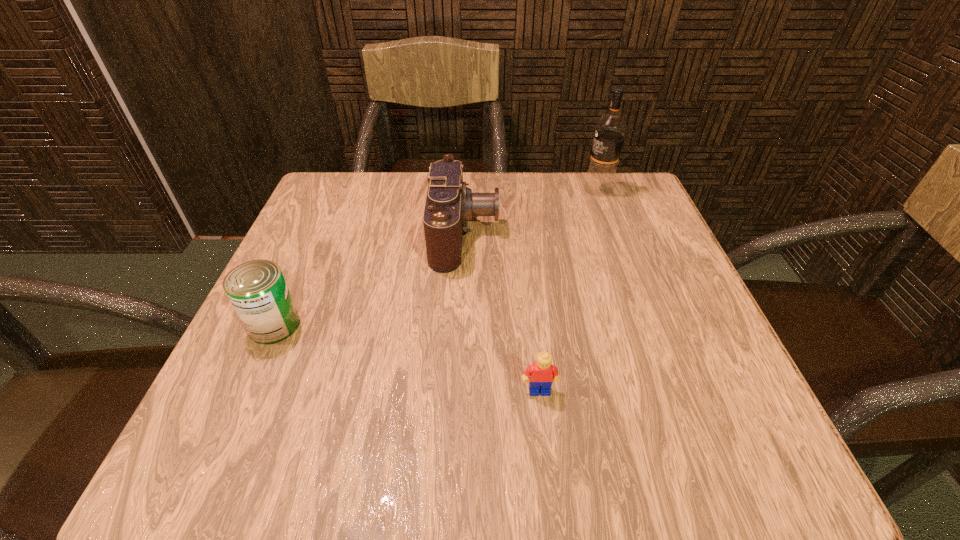
Locate an element on the screen. the tallest object is located at coordinates (610, 130).

This screenshot has width=960, height=540. Find the location of `the rightmost object`. the rightmost object is located at coordinates (610, 130).

Identify the location of the second object from left to right. This screenshot has height=540, width=960. (450, 204).

This screenshot has height=540, width=960. I want to click on the second farthest object, so click(450, 204).

Locate an element on the screen. The height and width of the screenshot is (540, 960). the third tallest object is located at coordinates (257, 289).

Find the location of a particular element. This screenshot has height=540, width=960. the leftmost object is located at coordinates (257, 289).

Identify the location of the nearest object. This screenshot has width=960, height=540. (542, 374).

You are a GUI agent. You are given a task and a screenshot of the screen. Output one action in this format:
    pyautogui.click(x=<x>, y=<y>)
    Task: Click on the Lego
    
    Given the screenshot: What is the action you would take?
    pyautogui.click(x=542, y=374)

Where is `vacant area situated on the label of the rightmost object`? The image size is (960, 540). vacant area situated on the label of the rightmost object is located at coordinates (527, 189).

Find the location of a particular element. The width and height of the screenshot is (960, 540). free space located on the label of the rightmost object is located at coordinates (544, 189).